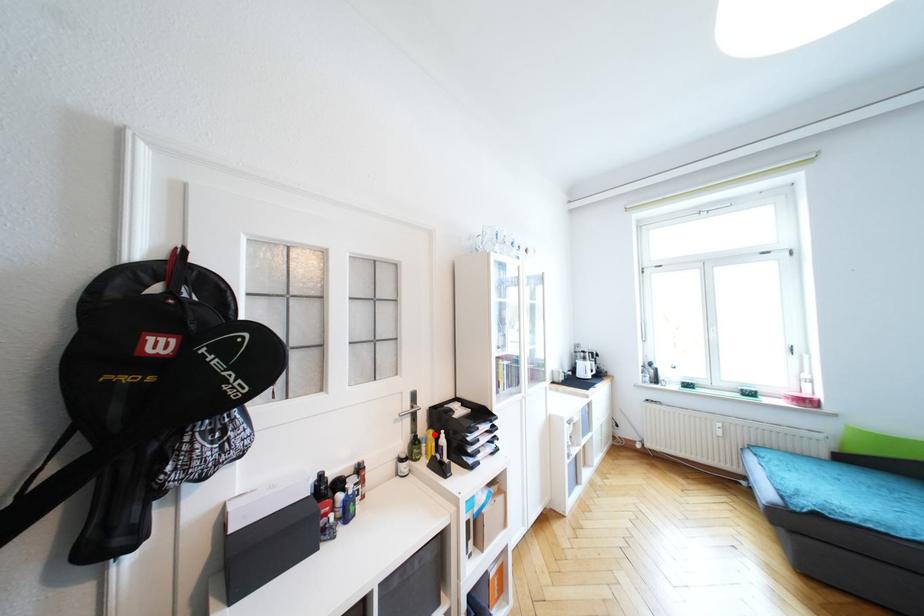
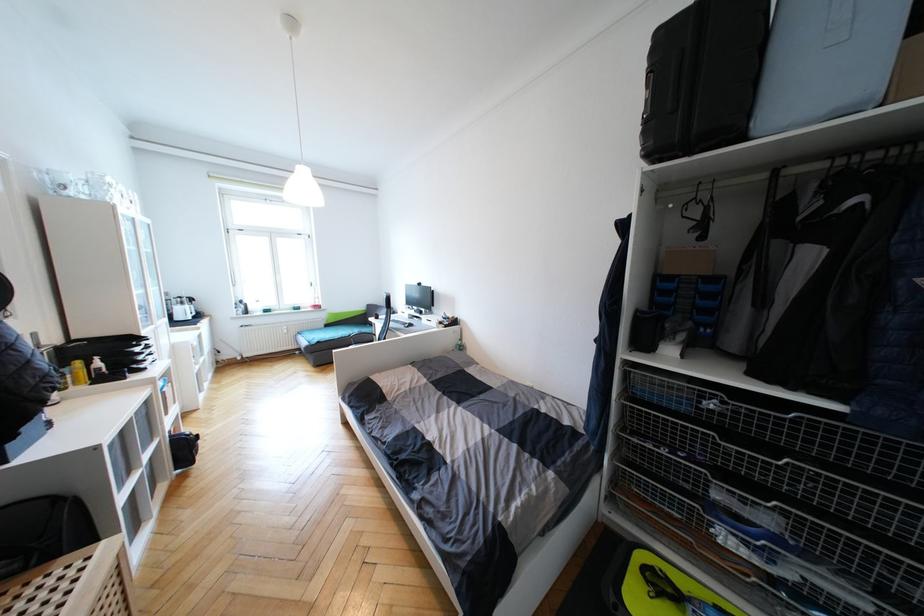
Question: I am providing you with two images of the same scene from different viewpoints. A red point is marked on the first image. At the location where the point appears in image 1, is it still visible in image 2?

Choices:
 (A) Yes
 (B) No

Answer: (A)